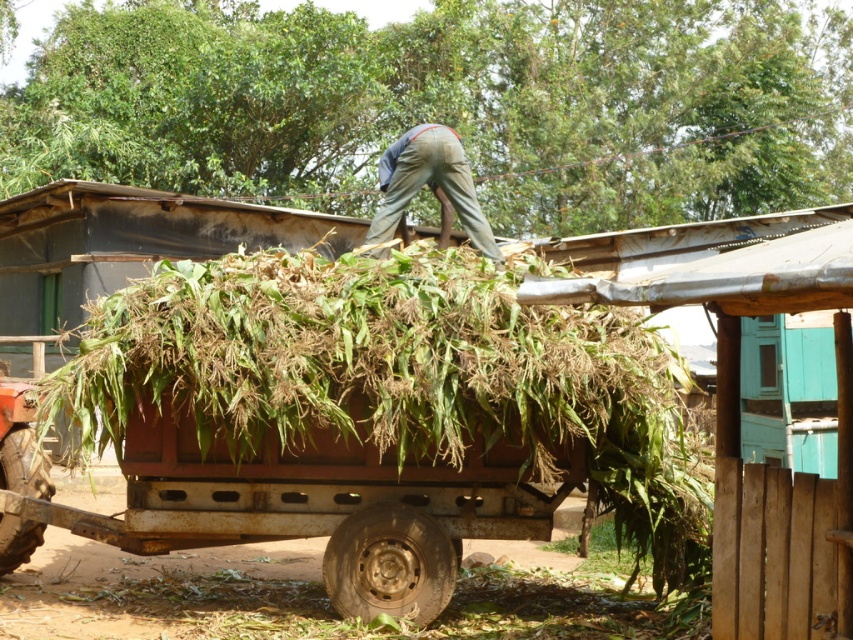
Consider the image. You are a farmer who needs to know if the green leafy hay at center will fit inside the rusty metal wagon at center. Based on their widths, can the hay be entirely contained within the wagon?

The green leafy hay at center is wider than the rusty metal wagon at center, so it cannot be entirely contained within the wagon.

You are a farmer trying to secure the load on your trailer. You notice the green leafy hay at center and the khaki pants at center. Which item is located to the left when viewed from the front of the trailer?

The green leafy hay at center is positioned on the left side of khaki pants at center, so when viewed from the front of the trailer, the green leafy hay at center is to the left of the khaki pants at center.